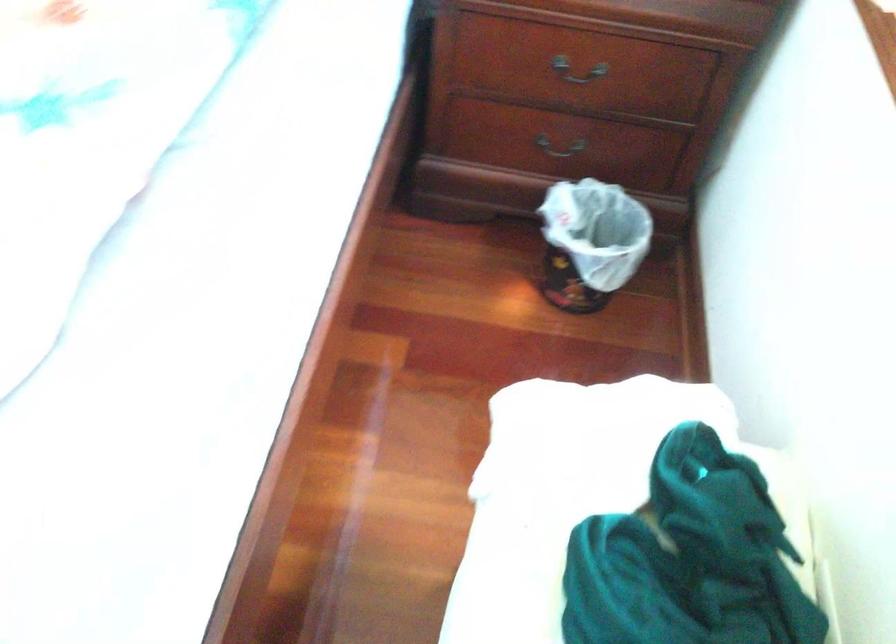
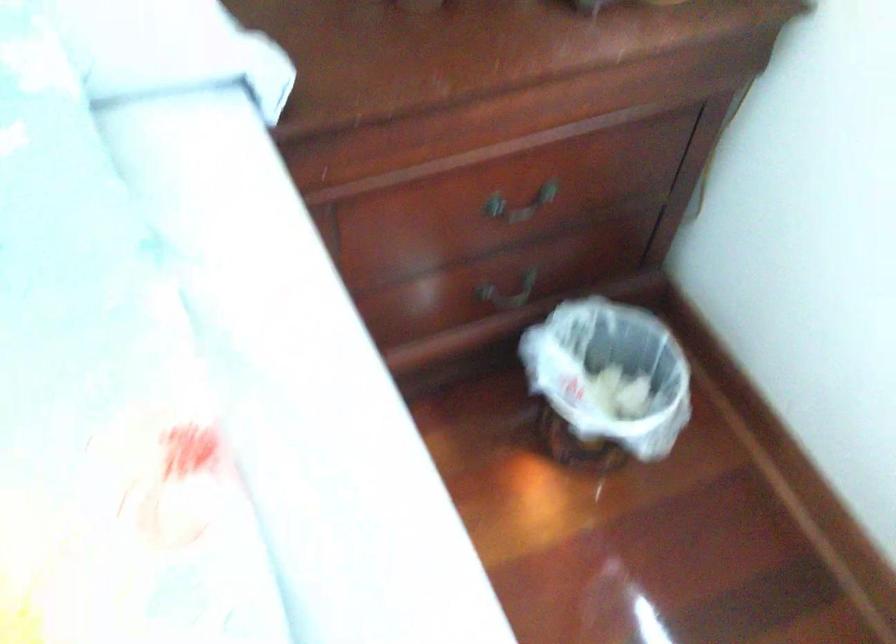
In the second image, find the point that corresponds to [575,71] in the first image.

(519, 205)